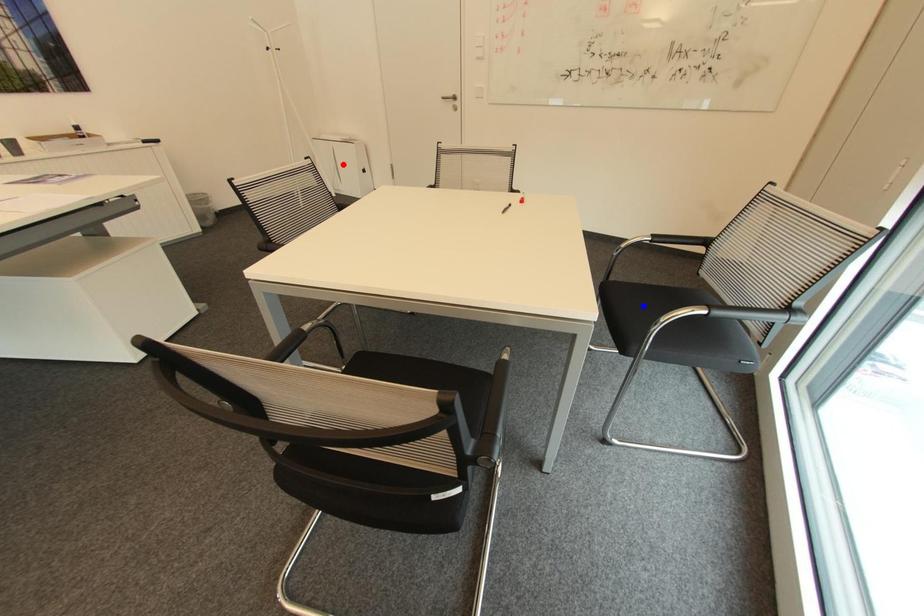
Question: Which of the two points in the image is closer to the camera?

Choices:
 (A) Blue point is closer.
 (B) Red point is closer.

Answer: (A)